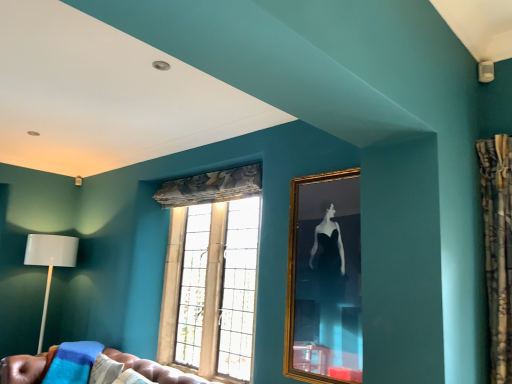
Question: From the image's perspective, is stained glass window at center positioned above or below gold-framed mirror at center-right?

Choices:
 (A) above
 (B) below

Answer: (B)

Question: In terms of size, does stained glass window at center appear bigger or smaller than gold-framed mirror at center-right?

Choices:
 (A) big
 (B) small

Answer: (A)

Question: Which of these objects is positioned closest to the leather tufted couch at lower left?

Choices:
 (A) gold-framed mirror at center-right
 (B) stained glass window at center
 (C) white matte floor lamp at left

Answer: (B)

Question: Which object is positioned closest to the white matte floor lamp at left?

Choices:
 (A) stained glass window at center
 (B) leather tufted couch at lower left
 (C) gold-framed mirror at center-right

Answer: (B)